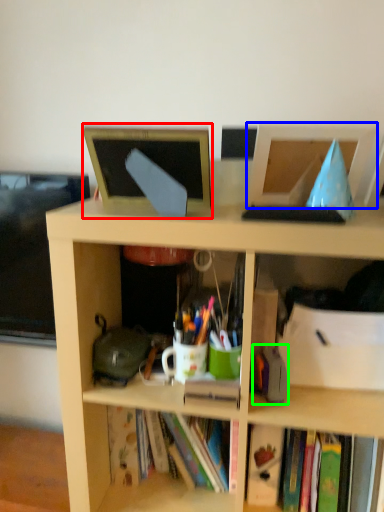
Question: Estimate the real-world distances between objects in this image. Which object is farther from computer monitor (highlighted by a red box), computer monitor (highlighted by a blue box) or stationery (highlighted by a green box)?

Choices:
 (A) computer monitor
 (B) stationery

Answer: (B)